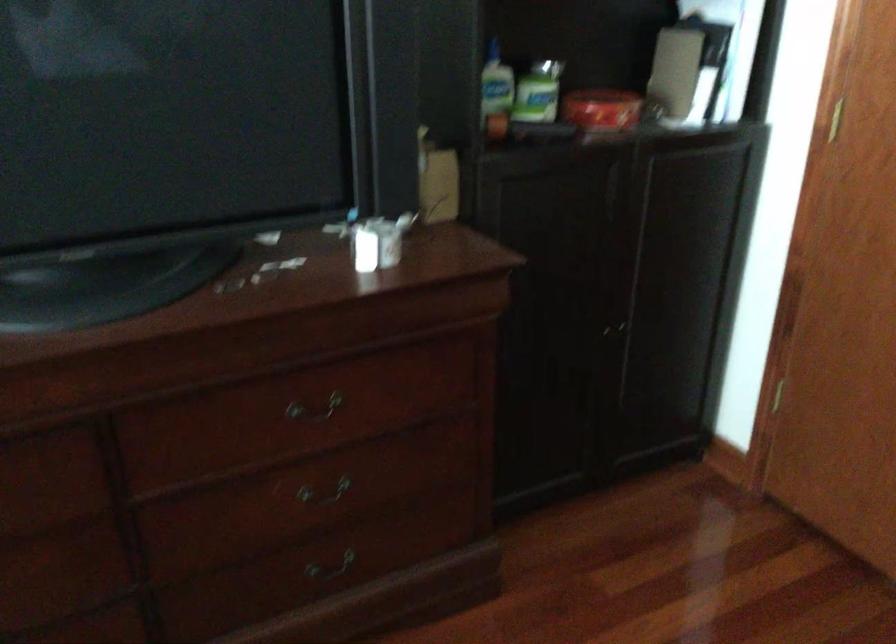
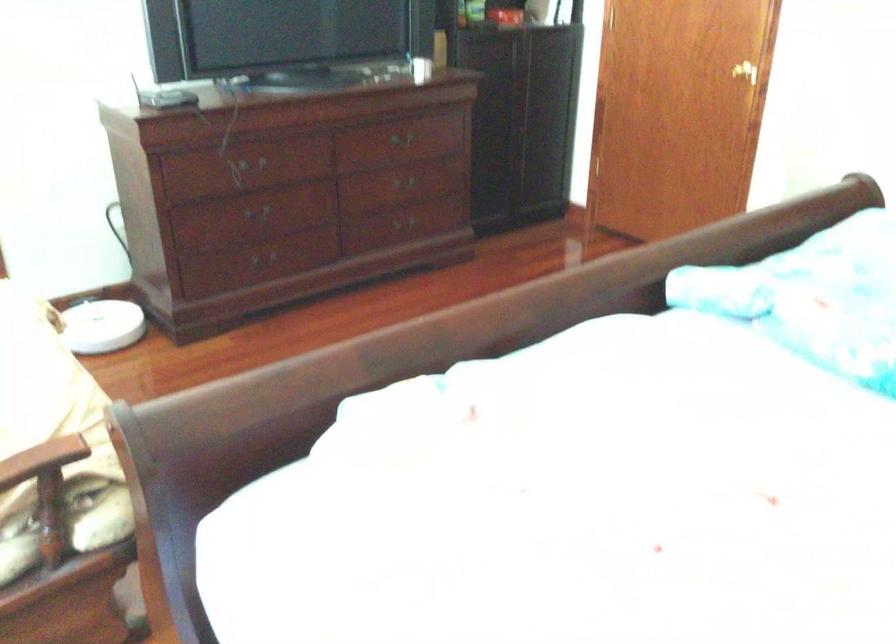
Find the pixel in the second image that matches (x=357, y=493) in the first image.

(409, 187)